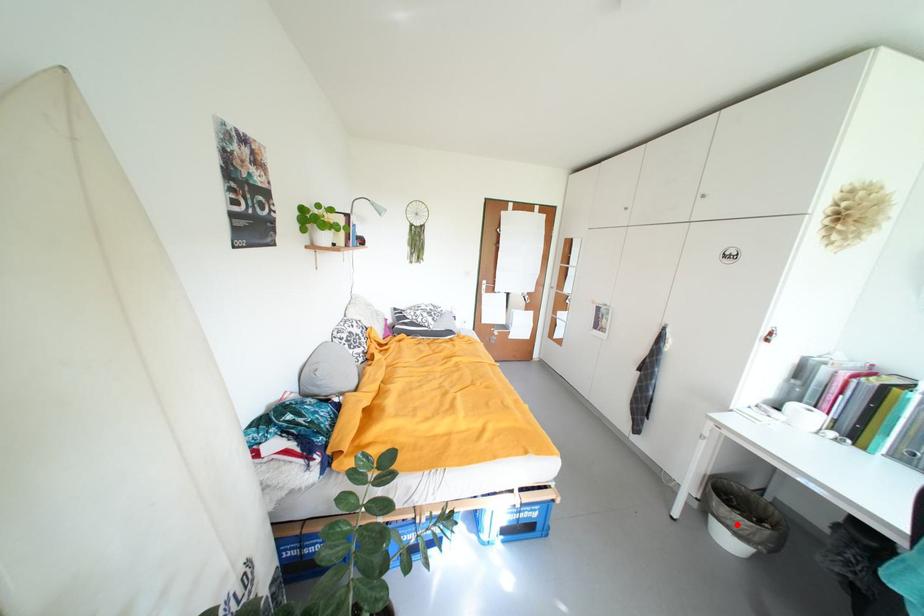
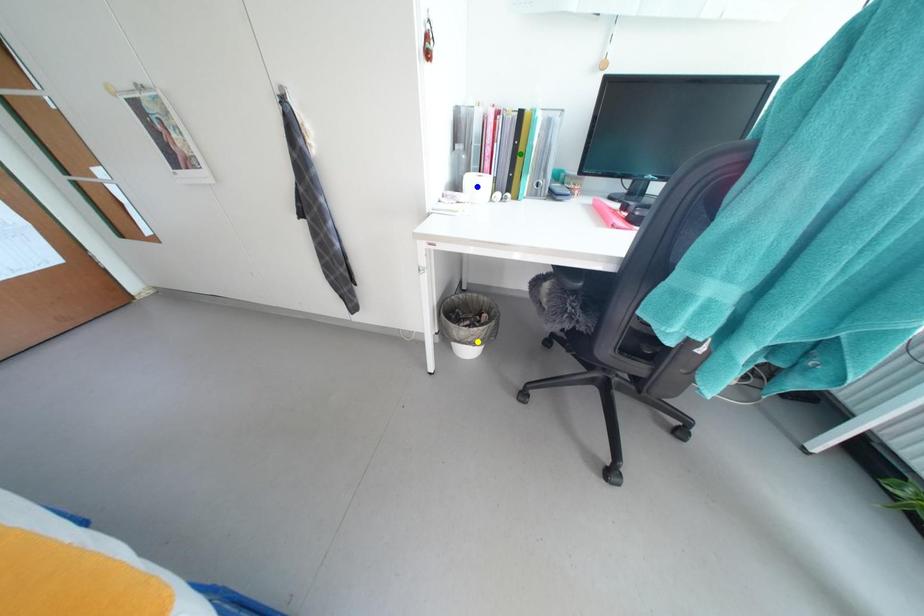
Question: I am providing you with two images of the same scene from different viewpoints. A red point is marked on the first image. You are given multiple points on the second image. In image 2, which mark is for the same physical point as the one in image 1?

Choices:
 (A) yellow point
 (B) blue point
 (C) green point

Answer: (A)